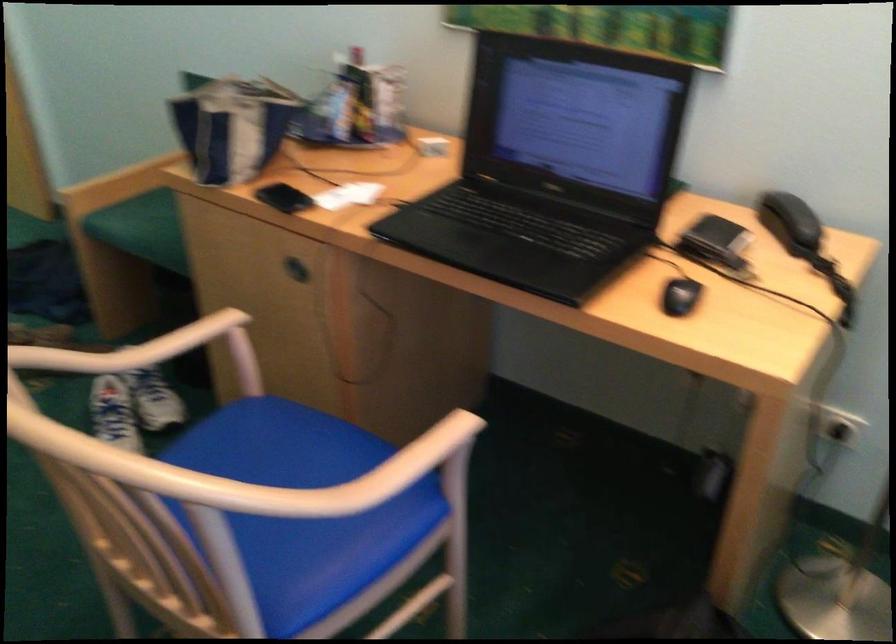
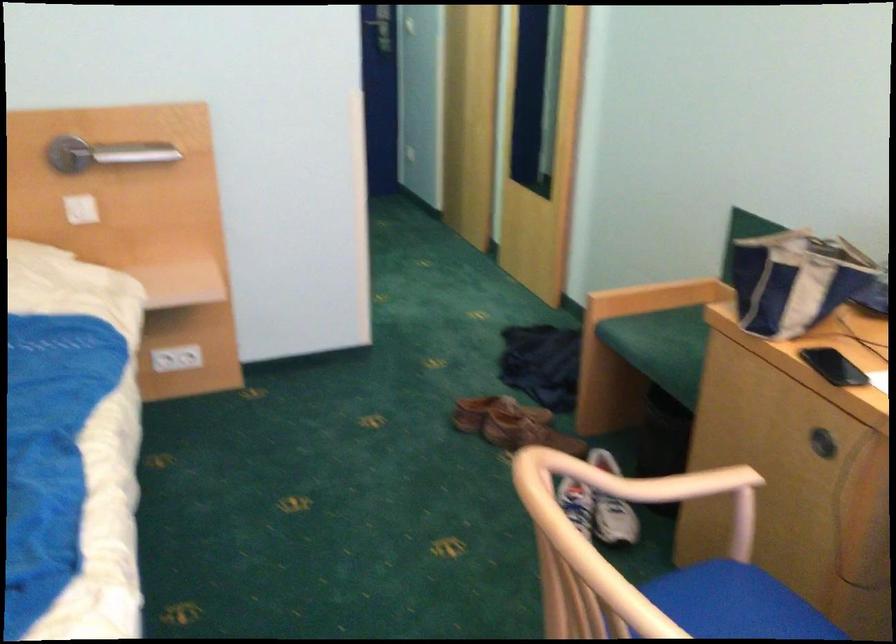
Locate, in the second image, the point that corresponds to point (230, 133) in the first image.

(794, 279)